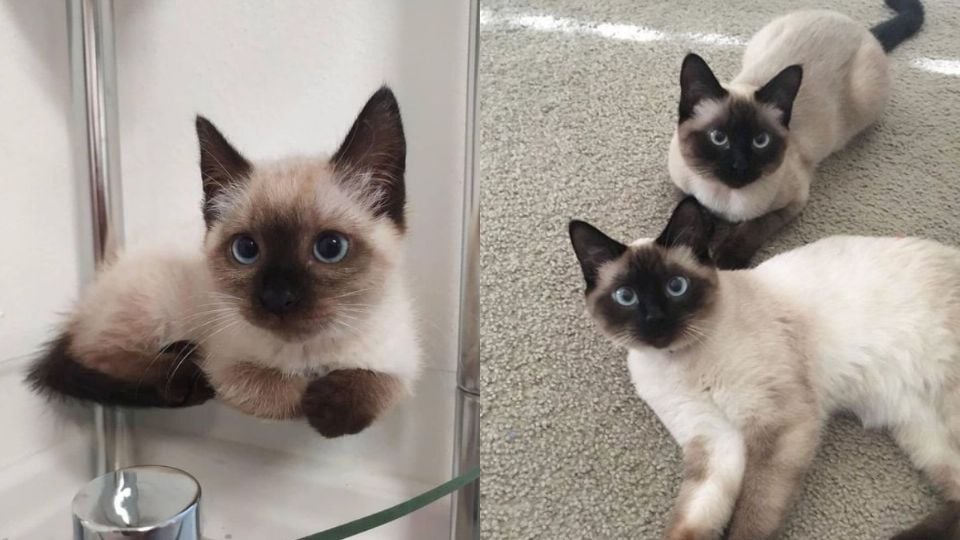
Where is `floor`? The image size is (960, 540). floor is located at coordinates (531, 138).